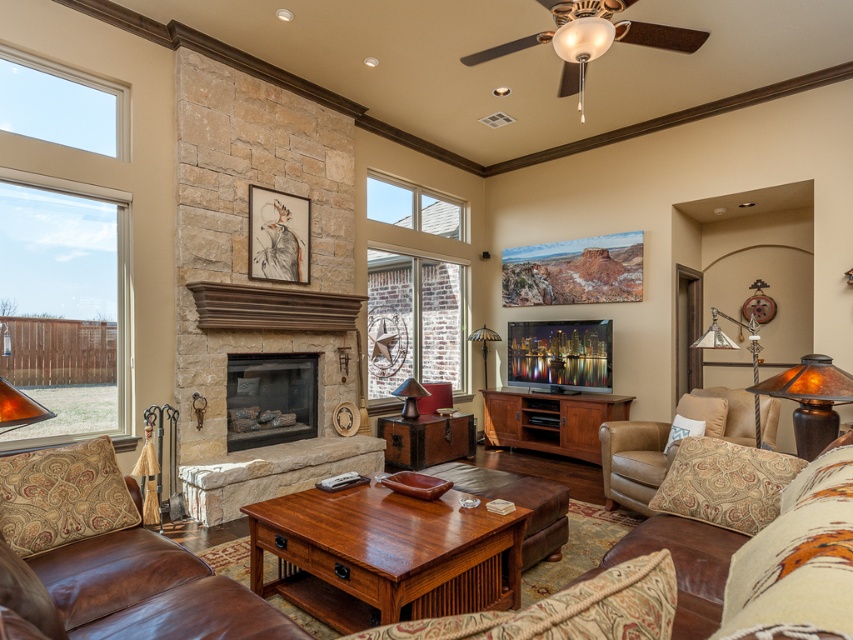
You are planning to hang a large painting that requires a sturdy wall anchor. You have two options for placement in the living room scene described. The first option is above the natural stone fireplace at center, and the second is above the brown wood tv stand at center. Based on their heights, which location would provide a more stable anchor point for the painting?

The natural stone fireplace at center has a greater height compared to the brown wood tv stand at center, so it would provide a more stable anchor point for the painting due to its sturdier structure and higher position.

You are arranging furniture in the living room and need to place a 3D sculpture that requires a wide base. Which object between the natural stone fireplace at center and the brown wood tv stand at center would be more suitable for placing the sculpture?

The brown wood tv stand at center is wider than the natural stone fireplace at center, so it would provide a more suitable base for the 3D sculpture that requires a wide base.